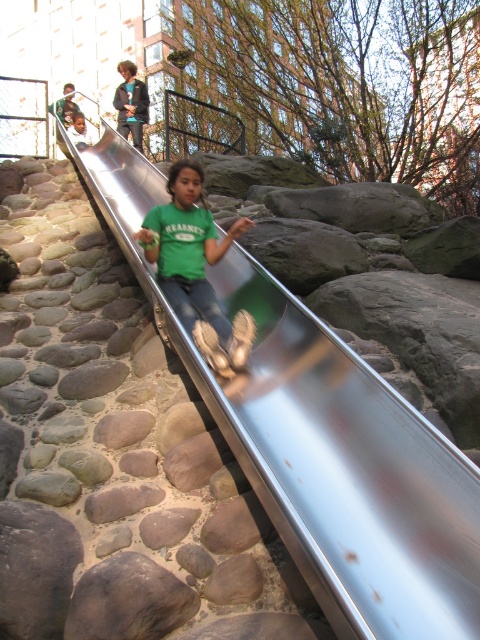
You are standing at the entrance of the playground and see the metallic smooth slide at center and the green matte shirt at center. Which object is positioned to the right of the other?

The metallic smooth slide at center is to the right of the green matte shirt at center.

You are standing at the entrance of the playground and see the metallic smooth slide at center. If you want to reach the slide quickly, which direction should you move towards?

To reach the metallic smooth slide at center quickly, you should move towards the center of the playground since it is located at point (323, 442), which is centrally positioned.

You are designing a new playground and want to ensure safety by placing a safety mat between the metallic smooth slide at center and the green matte shirt at center. Given that the slide is narrower than the shirt, which object requires a wider safety mat?

The green matte shirt at center requires a wider safety mat because the metallic smooth slide at center has a smaller width than the green matte shirt at center.